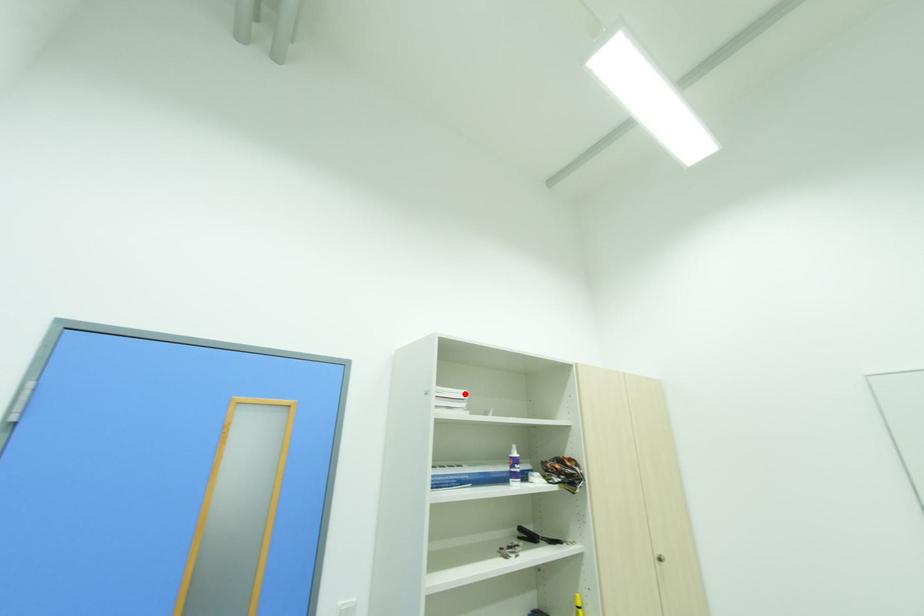
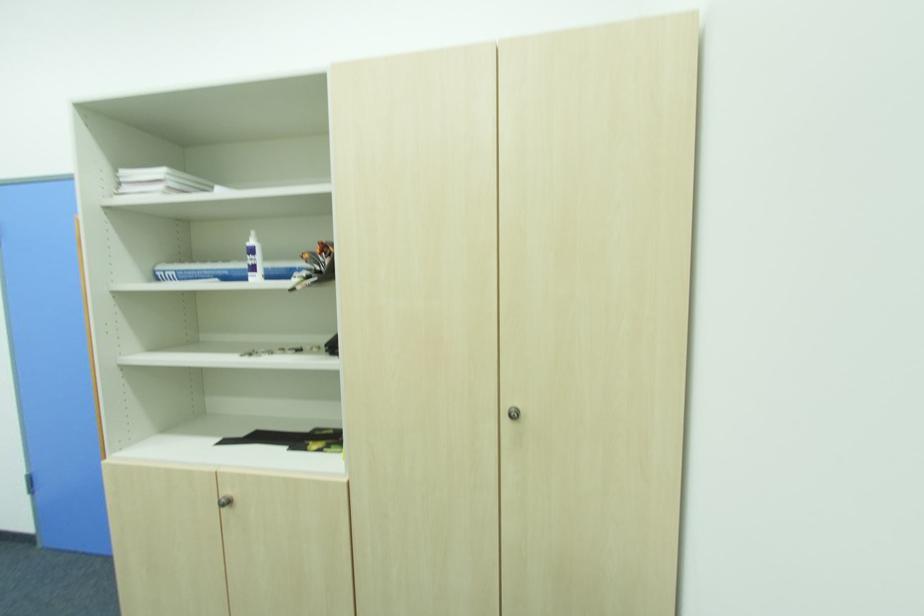
In the second image, find the point that corresponds to the highlighted location in the first image.

(161, 172)